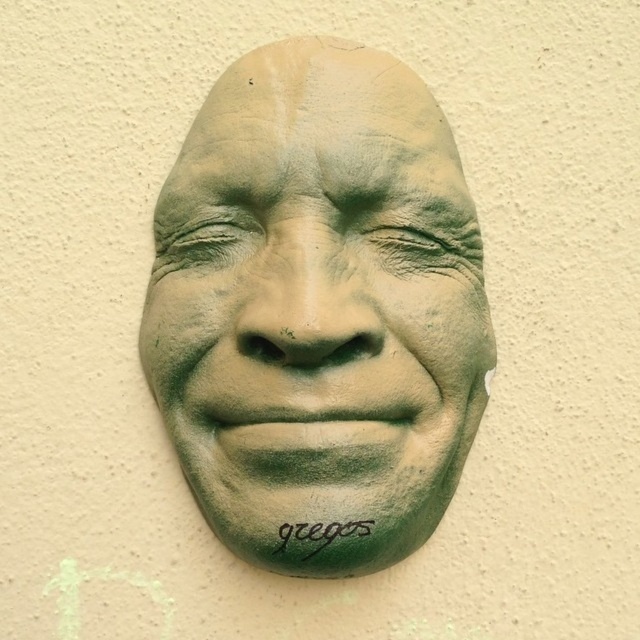
You are an art installer who needs to ensure that the green clay mask at center and the green matte text at center are aligned properly. Which object should you adjust if you want both to be the same width?

The green clay mask at center might be wider than green matte text at center, so you should adjust the green matte text at center to match the width of the green clay mask at center.

You are an art conservator examining a wall sculpture. You notice a point at coordinates (x=317, y=305). What object is located at this point?

The point at coordinates (x=317, y=305) indicates the green clay mask at center.